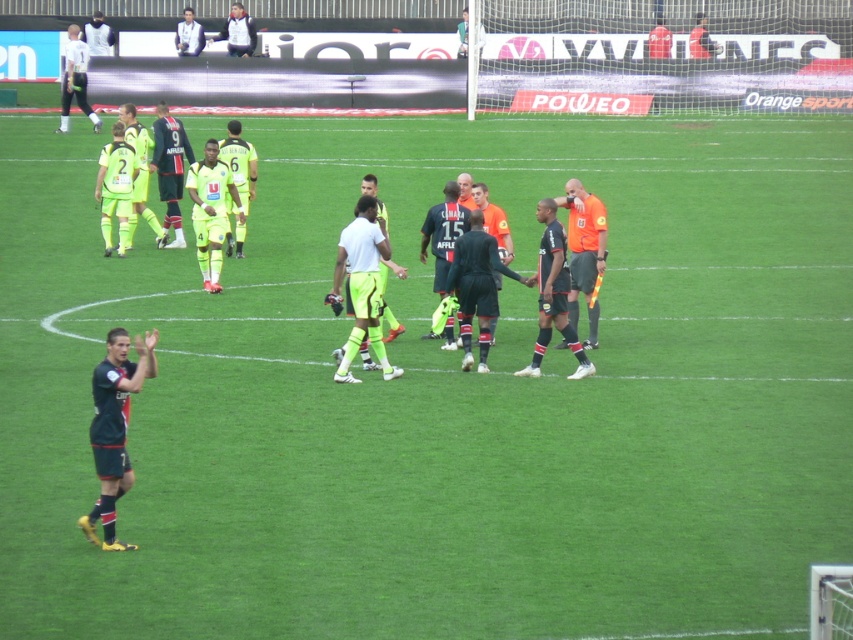
You are a photographer positioned at the origin point of the field. You want to capture a photo of the black jersey at center. What are the coordinates where you should aim your camera?

The black jersey at center is located at point (553, 294), so you should aim your camera at those coordinates to capture it.

You are a photographer positioned at the edge of the soccer field. You want to capture a photo where both the black jersey at center and the light blue shirt at upper center are visible. Considering their positions and sizes, which player should you focus on first to ensure both are in frame?

The black jersey at center has a greater height compared to the light blue shirt at upper center. To ensure both are in frame, focus on the black jersey at center first since it is larger and occupies more space, allowing the smaller light blue shirt at upper center to fit into the composition.

Looking at this image, based on the scene description, where is the black jersey at center located in terms of coordinates?

The black jersey at center is located at coordinates point (553, 294).